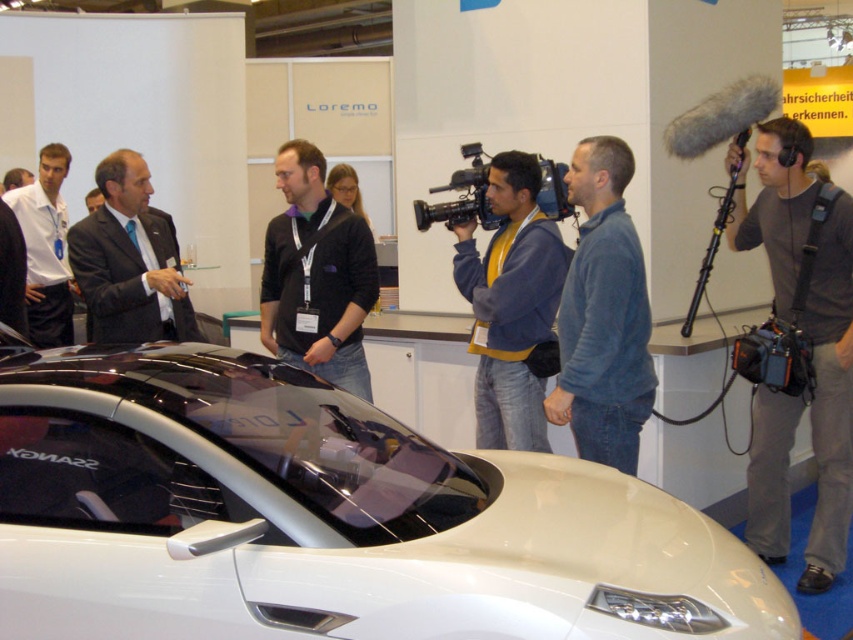
You are a photographer positioned at point 0.5, 0.5 in the image coordinate system. You need to capture a photo of the white glossy car at center without any background distractions. Based on its current position at point 0.811, 0.382, should you move left or right to frame the car better?

The white glossy car at center is located at point (325,518). Since you are at (426,320), you should move to the right to frame the car better and reduce background distractions.

You are a photographer at the exhibition and need to place a small sticker exactly at the point with coordinates point (461,196). Where should you place the sticker?

The point (461,196) is on black plastic video camera at center, so you should place the sticker on the black plastic video camera at center.